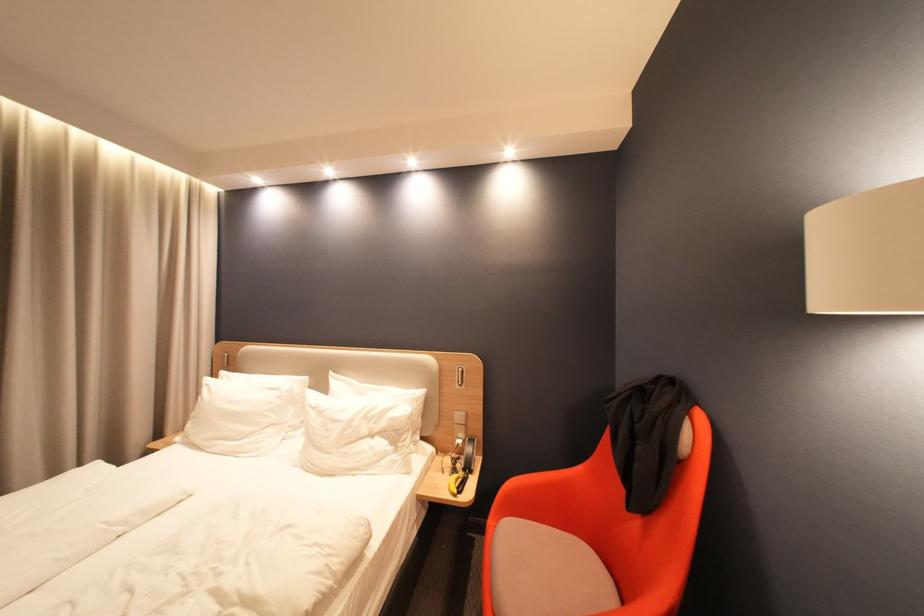
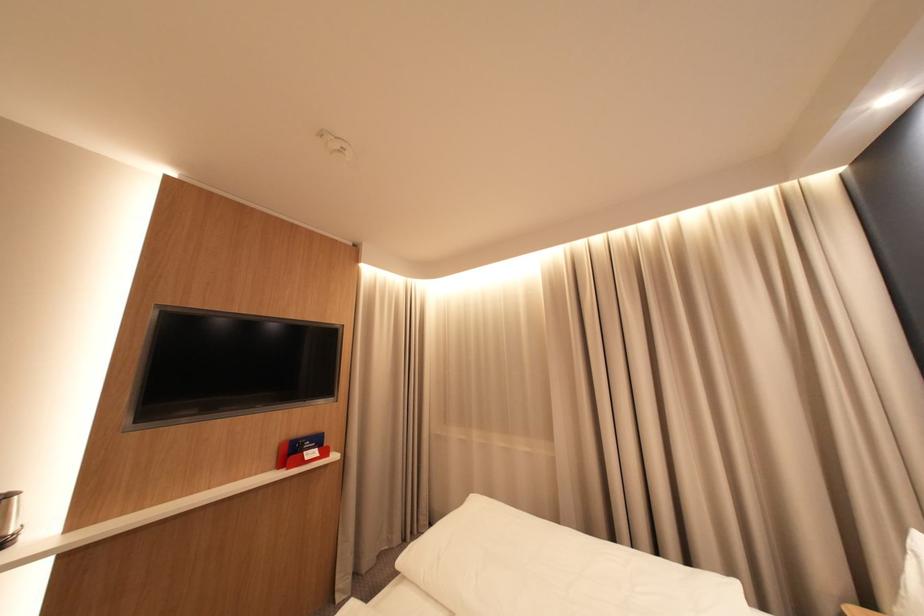
Question: The camera is either moving clockwise (left) or counter-clockwise (right) around the object. The first image is from the beginning of the video and the second image is from the end. Is the camera moving left or right when shooting the video?

Choices:
 (A) Left
 (B) Right

Answer: (B)